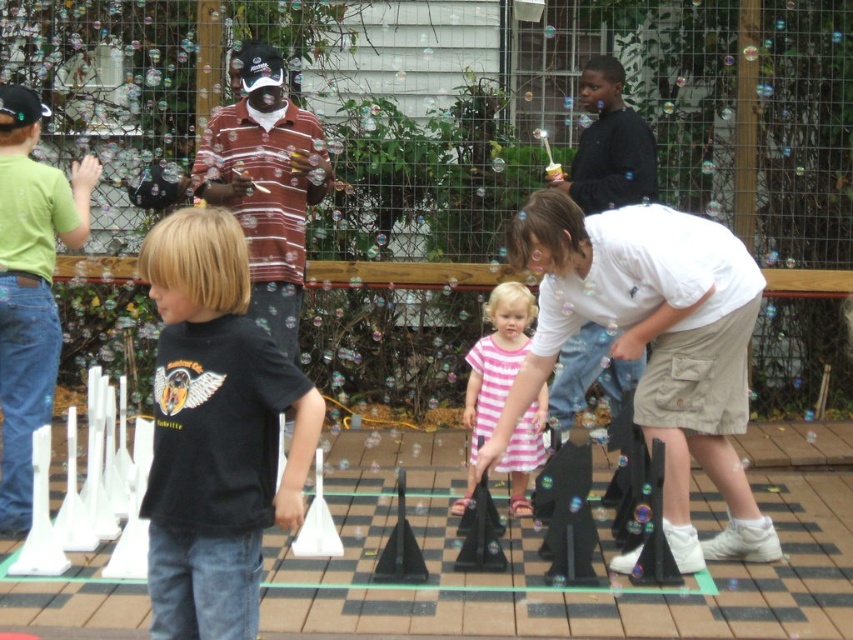
Question: Based on their relative distances, which object is farther from the white cotton shirt at center?

Choices:
 (A) black matte shirt at center
 (B) pink striped dress at center

Answer: (A)

Question: Based on their relative distances, which object is nearer to the pink striped dress at center?

Choices:
 (A) white cotton shirt at center
 (B) black matte shirt at center

Answer: (A)

Question: Where is white cotton shirt at center located in relation to black matte shirt at center in the image?

Choices:
 (A) below
 (B) above

Answer: (A)

Question: Does white cotton shirt at center come in front of pink striped dress at center?

Choices:
 (A) yes
 (B) no

Answer: (A)

Question: Which of the following is the closest to the observer?

Choices:
 (A) [x=688, y=512]
 (B) [x=265, y=352]
 (C) [x=543, y=417]

Answer: (B)

Question: Does white cotton shirt at center appear on the left side of black matte shirt at center?

Choices:
 (A) no
 (B) yes

Answer: (A)